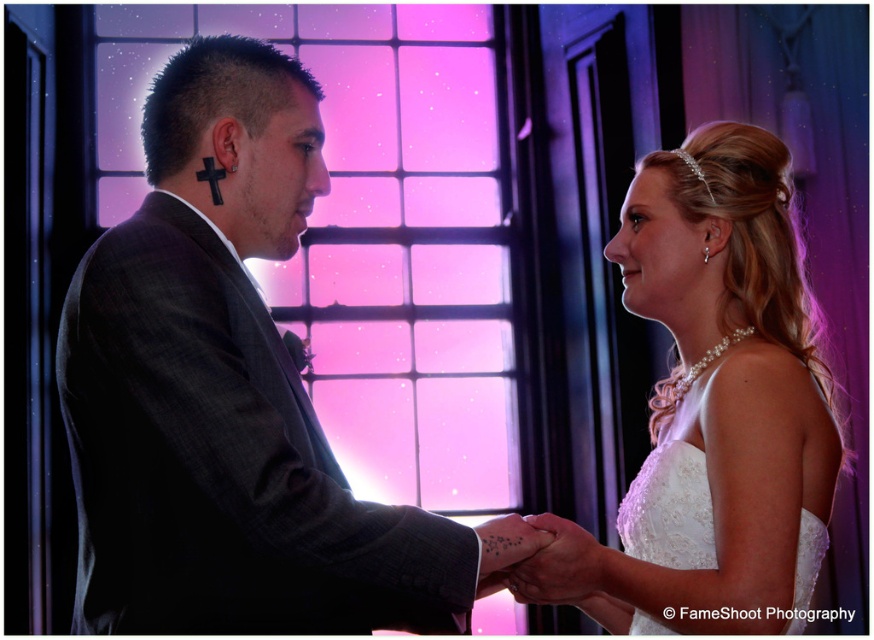
Question: Observing the image, what is the correct spatial positioning of matte black suit at left in reference to white lace wedding dress at right?

Choices:
 (A) above
 (B) below

Answer: (A)

Question: Which of the following is the farthest from the observer?

Choices:
 (A) (281, 81)
 (B) (703, 419)

Answer: (B)

Question: Estimate the real-world distances between objects in this image. Which object is farther from the white lace dress at right?

Choices:
 (A) matte black hand at center
 (B) white lace wedding dress at right
 (C) matte black suit at left

Answer: (C)

Question: Which of the following is the farthest from the observer?

Choices:
 (A) (562, 572)
 (B) (715, 470)

Answer: (A)

Question: Does matte black suit at left have a smaller size compared to white lace dress at right?

Choices:
 (A) yes
 (B) no

Answer: (B)

Question: Does matte black suit at left have a smaller size compared to white lace wedding dress at right?

Choices:
 (A) yes
 (B) no

Answer: (B)